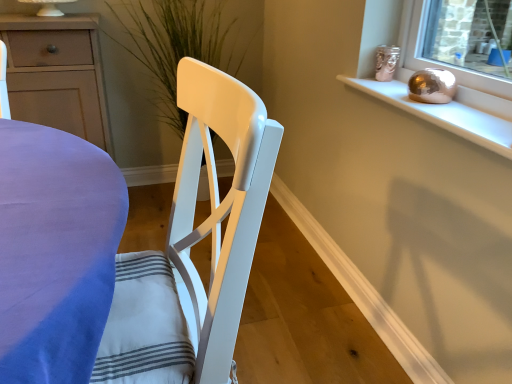
Find the location of `white glossy chair at center`. white glossy chair at center is located at coordinates (194, 244).

In order to face white glossy chair at center, should I rotate leftwards or rightwards?

Turn left approximately 16.444 degrees to face it.

Identify the location of green matte plant at center. (178, 45).

Is point (215, 197) positioned behind point (178, 35)?

No, (215, 197) is in front of (178, 35).

Can you confirm if white glossy chair at center is wider than green matte plant at center?

In fact, white glossy chair at center might be narrower than green matte plant at center.

Does white glossy chair at center have a larger size compared to green matte plant at center?

Incorrect, white glossy chair at center is not larger than green matte plant at center.

Looking at this image, is white glossy chair at center closer to the viewer compared to green matte plant at center?

Yes.

Is white glossy chair at center spatially inside metallic gold sphere at upper right, or outside of it?

white glossy chair at center exists outside the volume of metallic gold sphere at upper right.

Is white glossy chair at center at the right side of metallic gold sphere at upper right?

No.

How different are the orientations of white glossy chair at center and metallic gold sphere at upper right in degrees?

6.7 degrees.

You are a GUI agent. You are given a task and a screenshot of the screen. Output one action in this format:
    pyautogui.click(x=<x>, y=<y>)
    Task: Click on the plant above the matte white cabinet at left (from a real-world perspective)
    The width and height of the screenshot is (512, 384).
    Given the screenshot: What is the action you would take?
    pyautogui.click(x=178, y=45)

Is matte white cabinet at left not close to green matte plant at center?

No.

In the scene shown: Between matte white cabinet at left and green matte plant at center, which one has larger width?

With larger width is green matte plant at center.

Is there a large distance between metallic gold sphere at upper right and green matte plant at center?

Yes.

In the scene shown: From a real-world perspective, is metallic gold sphere at upper right above or below green matte plant at center?

From a real-world perspective, metallic gold sphere at upper right is physically above green matte plant at center.

Image resolution: width=512 pixels, height=384 pixels. Find the location of `plant behind the metallic gold sphere at upper right`. plant behind the metallic gold sphere at upper right is located at coordinates (178, 45).

In terms of size, does metallic gold sphere at upper right appear bigger or smaller than green matte plant at center?

Considering their sizes, metallic gold sphere at upper right takes up less space than green matte plant at center.

Does green matte plant at center appear on the left side of metallic gold sphere at upper right?

Indeed, green matte plant at center is positioned on the left side of metallic gold sphere at upper right.

From the image's perspective, between green matte plant at center and metallic gold sphere at upper right, who is located below?

metallic gold sphere at upper right.

Is green matte plant at center oriented towards metallic gold sphere at upper right?

Yes, green matte plant at center faces towards metallic gold sphere at upper right.

Who is more distant, white glossy chair at center or matte white cabinet at left?

matte white cabinet at left is behind.

Is white glossy chair at center next to matte white cabinet at left and touching it?

white glossy chair at center is not next to matte white cabinet at left, and they're not touching.

Locate an element on the screen. The height and width of the screenshot is (384, 512). chair on the right of matte white cabinet at left is located at coordinates (194, 244).

Between white glossy chair at center and matte white cabinet at left, which one has smaller size?

matte white cabinet at left is smaller.

Which object is positioned more to the left, matte white cabinet at left or metallic gold sphere at upper right?

Positioned to the left is matte white cabinet at left.

Considering the points (35, 70) and (490, 102), which point is behind, point (35, 70) or point (490, 102)?

The point (35, 70) is behind.

Relative to metallic gold sphere at upper right, is matte white cabinet at left in front or behind?

Clearly, matte white cabinet at left is behind metallic gold sphere at upper right.

From the image's perspective, is matte white cabinet at left over metallic gold sphere at upper right?

Indeed, from the image's perspective, matte white cabinet at left is shown above metallic gold sphere at upper right.

Identify the location of plant lying above the white glossy chair at center (from the image's perspective). (178, 45).

Where is `chair beneath the metallic gold sphere at upper right (from a real-world perspective)`? Image resolution: width=512 pixels, height=384 pixels. chair beneath the metallic gold sphere at upper right (from a real-world perspective) is located at coordinates (194, 244).

When comparing their distances from green matte plant at center, does white glossy chair at center or matte white cabinet at left seem closer?

matte white cabinet at left lies closer to green matte plant at center than the other object.

Based on their spatial positions, is matte white cabinet at left or metallic gold sphere at upper right further from green matte plant at center?

Among the two, metallic gold sphere at upper right is located further to green matte plant at center.

Looking at the image, which one is located closer to green matte plant at center, metallic gold sphere at upper right or white glossy chair at center?

metallic gold sphere at upper right is positioned closer to the anchor green matte plant at center.

Based on their spatial positions, is green matte plant at center or matte white cabinet at left further from white glossy chair at center?

green matte plant at center is positioned further to the anchor white glossy chair at center.

Considering their positions, is metallic gold sphere at upper right positioned further to white glossy chair at center than green matte plant at center?

green matte plant at center lies further to white glossy chair at center than the other object.

When comparing their distances from green matte plant at center, does metallic gold sphere at upper right or matte white cabinet at left seem further?

Based on the image, metallic gold sphere at upper right appears to be further to green matte plant at center.

Estimate the real-world distances between objects in this image. Which object is closer to metallic gold sphere at upper right, green matte plant at center or white glossy chair at center?

white glossy chair at center is positioned closer to the anchor metallic gold sphere at upper right.

Based on their spatial positions, is matte white cabinet at left or white glossy chair at center closer to green matte plant at center?

Among the two, matte white cabinet at left is located nearer to green matte plant at center.

This screenshot has height=384, width=512. Identify the location of plant between matte white cabinet at left and metallic gold sphere at upper right in the horizontal direction. point(178,45).

The width and height of the screenshot is (512, 384). What are the coordinates of `chair between matte white cabinet at left and metallic gold sphere at upper right` in the screenshot? It's located at (194, 244).

Find the location of a particular element. window sill located between white glossy chair at center and green matte plant at center in the depth direction is located at coordinates (449, 112).

Locate an element on the screen. The width and height of the screenshot is (512, 384). cabinetry positioned between white glossy chair at center and green matte plant at center from near to far is located at coordinates (57, 74).